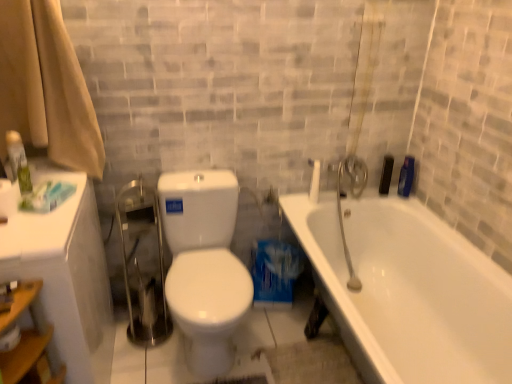
Where is `free spot in front of black plastic razor at upper right, placed as the 1th toiletry when sorted from back to front`? free spot in front of black plastic razor at upper right, placed as the 1th toiletry when sorted from back to front is located at coordinates (401, 205).